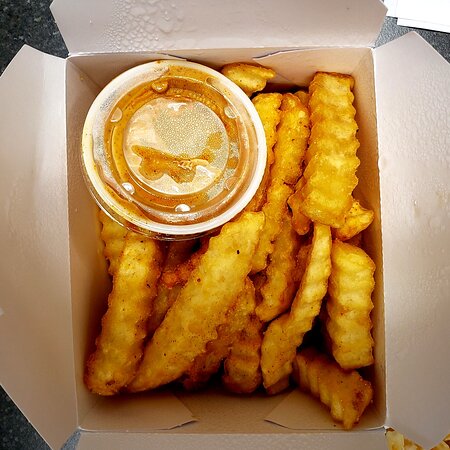
You are a GUI agent. You are given a task and a screenshot of the screen. Output one action in this format:
    pyautogui.click(x=<x>, y=<y>)
    Task: Click on the plastic cup
    
    Given the screenshot: What is the action you would take?
    pyautogui.click(x=167, y=147)